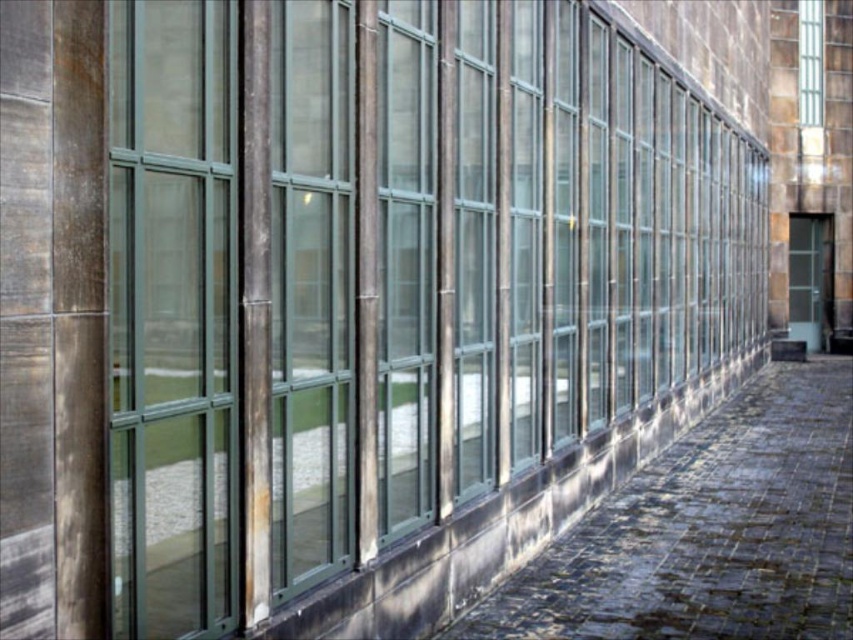
You are standing in front of the building and see the clear glass door at right and the dark gray cobblestone at center. Which object is located lower in the image?

The dark gray cobblestone at center is positioned under the clear glass door at right, so it is located lower in the image.